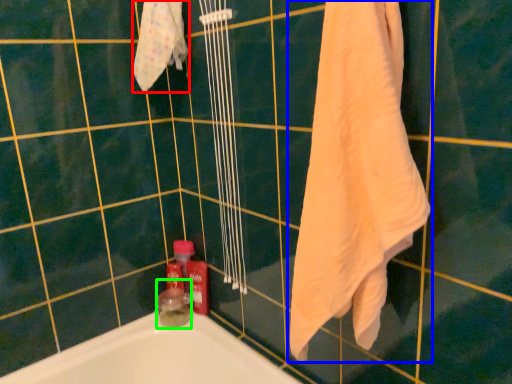
Question: Considering the real-world distances, which object is closest to bath towel (highlighted by a red box)? towel (highlighted by a blue box) or toiletry (highlighted by a green box).

Choices:
 (A) towel
 (B) toiletry

Answer: (A)